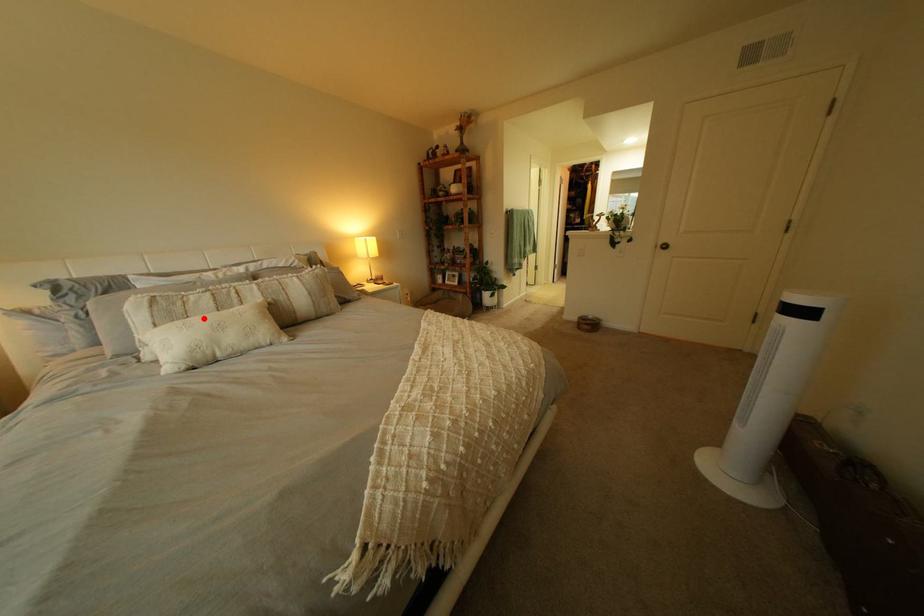
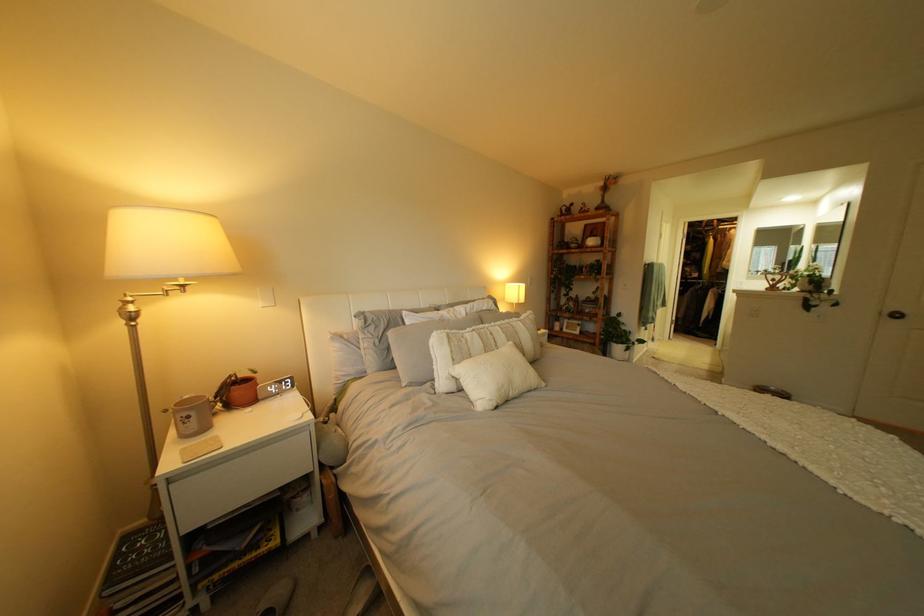
Where in the second image is the point corresponding to the highlighted location from the first image?

(485, 355)